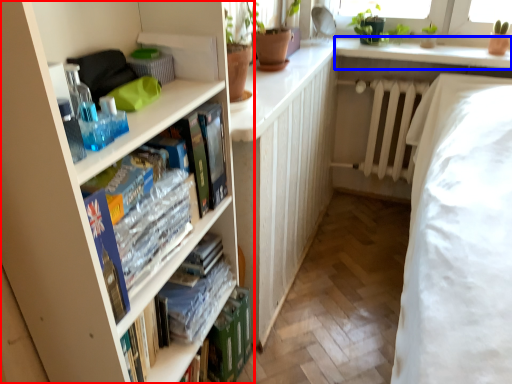
Question: Which of the following is the farthest to the observer, bookcase (highlighted by a red box) or window sill (highlighted by a blue box)?

Choices:
 (A) bookcase
 (B) window sill

Answer: (B)